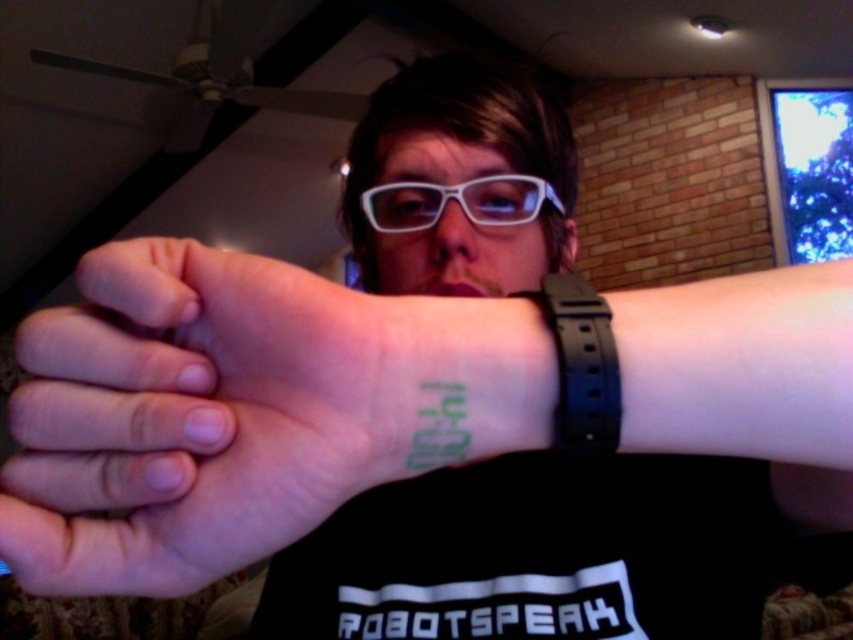
You are a photographer adjusting your camera settings. You notice two points in the image at coordinates point (595,356) and point (468,198). Which of these points is nearer to the camera lens?

Point (595,356) is closer to the camera lens than point (468,198).

You are a detective examining the scene. You notice the green ink tattoo at center and the white matte glasses at center. Based on their positions, which object is closer to your left side when facing the scene?

The green ink tattoo at center is to the left of white matte glasses at center, so when facing the scene, the green ink tattoo at center is closer to your left side.

Looking at this image, you are a robot trying to determine the position of the green ink tattoo at center and the black rubber wristband at upper right on a person. Based on the scene, which object is nearer to you?

The green ink tattoo at center is closer to the viewer than the black rubber wristband at upper right.